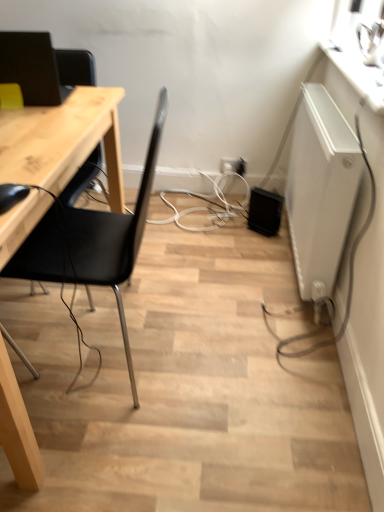
Where is `free space in front of matte black monitor at upper left`? This screenshot has height=512, width=384. free space in front of matte black monitor at upper left is located at coordinates (37, 116).